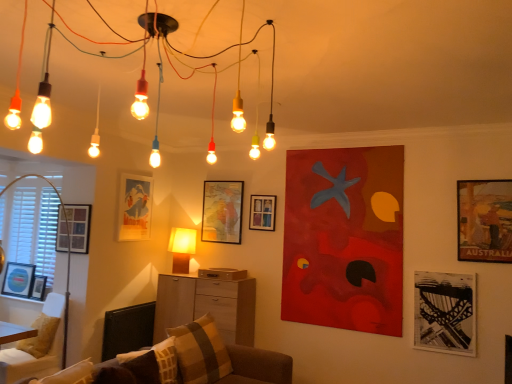
Question: Is point (128, 211) positioned closer to the camera than point (203, 288)?

Choices:
 (A) farther
 (B) closer

Answer: (A)

Question: In terms of height, does matte paper picture frame at upper left, which is counted as the fifth picture frame, starting from the right, look taller or shorter compared to wooden cabinet at center?

Choices:
 (A) short
 (B) tall

Answer: (A)

Question: Based on their relative distances, which object is farther from the brown textured pillow at lower center, acting as the 1th pillow starting from the front?

Choices:
 (A) matte blue picture frame at left, the 8th picture frame positioned from the right
 (B) plush brown couch at lower center
 (C) wooden drawer at center
 (D) light brown fabric sofa at lower left
 (E) matte black picture frame at left, which appears as the second picture frame when viewed from the left

Answer: (A)

Question: Estimate the real-world distances between objects in this image. Which object is closer to the matte glass lightbulbs at upper center?

Choices:
 (A) white matte window screen at left
 (B) matte paper picture frame at upper left, which is counted as the fifth picture frame, starting from the right
 (C) plaid fabric pillow at lower center, which ranks as the first pillow in back-to-front order
 (D) wooden textured poster at upper right, which is the eighth picture frame in left-to-right order
 (E) black matte picture frame at lower right, the 7th picture frame from the left

Answer: (C)